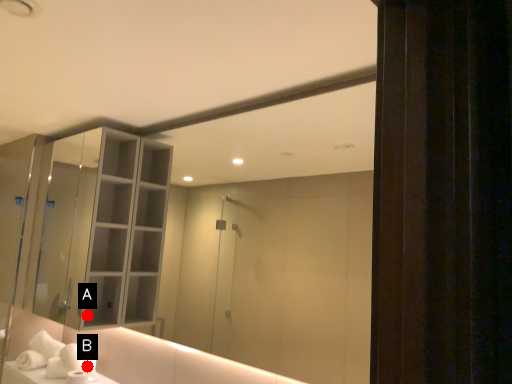
Question: Two points are circled on the image, labeled by A and B beside each circle. Which point appears farthest from the camera in this image?

Choices:
 (A) A is further
 (B) B is further

Answer: (B)